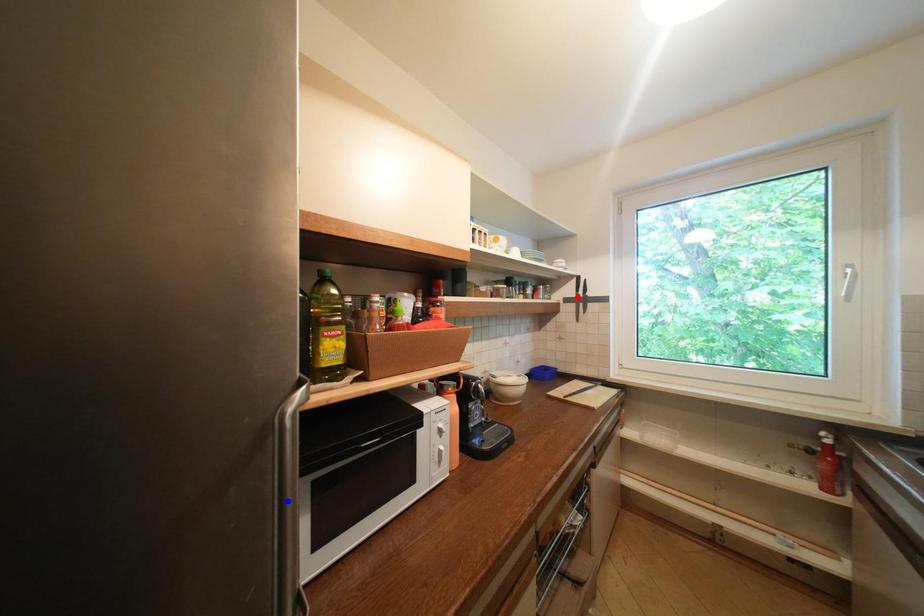
Question: Two points are marked on the image. Which point is closer to the camera?

Choices:
 (A) Blue point is closer.
 (B) Red point is closer.

Answer: (A)